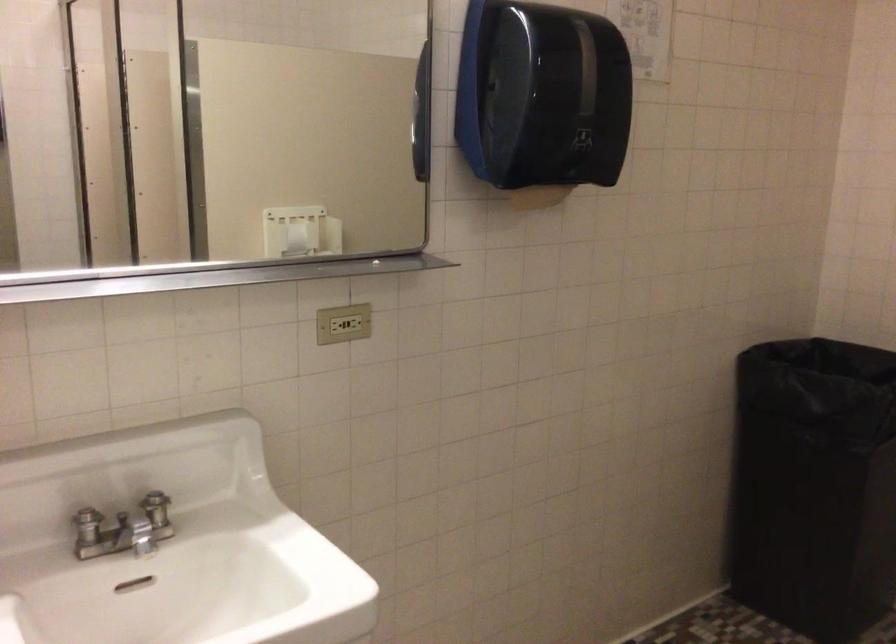
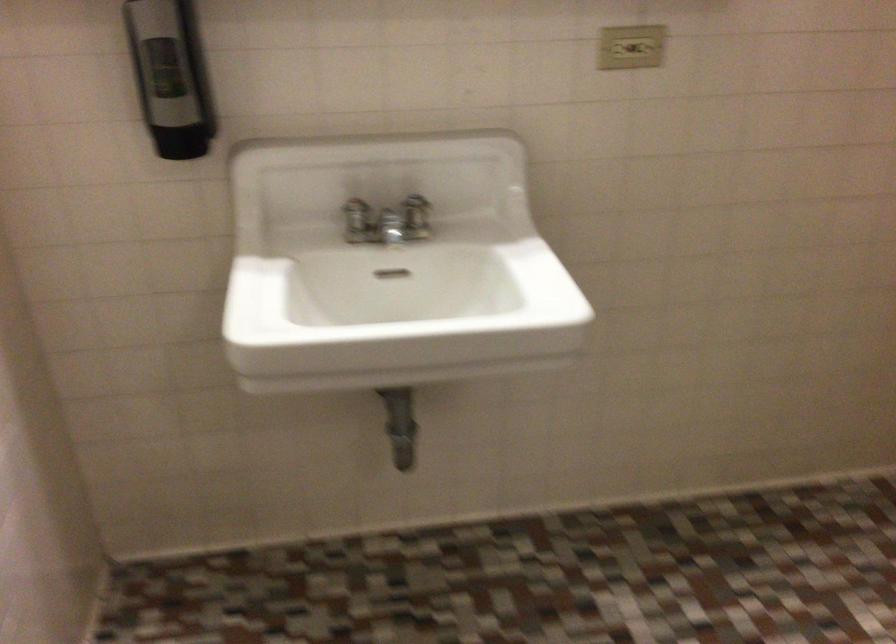
The point at (138, 535) is marked in the first image. Where is the corresponding point in the second image?

(391, 225)